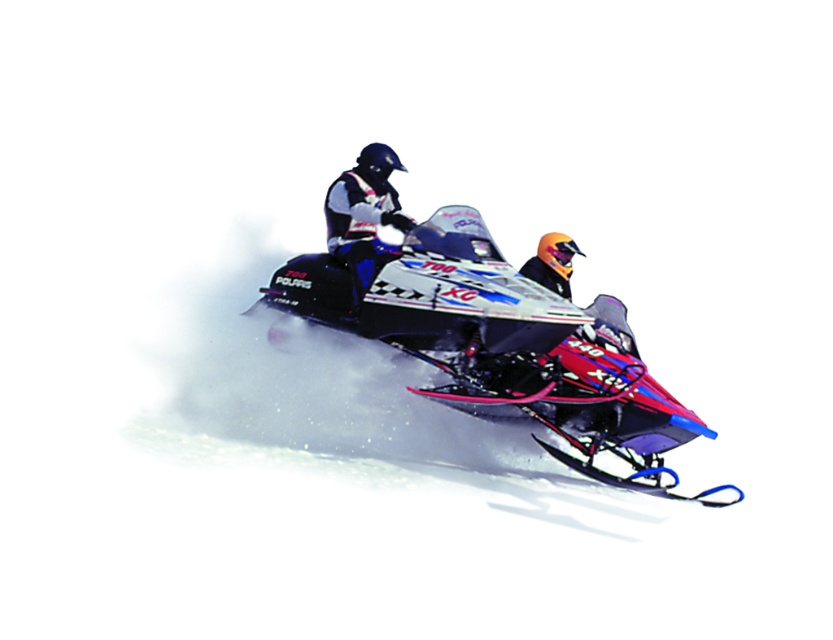
Which is below, shiny metallic snowmobile at center or orange matte helmet at center?

Positioned lower is shiny metallic snowmobile at center.

Does shiny metallic snowmobile at center appear on the left side of orange matte helmet at center?

Indeed, shiny metallic snowmobile at center is positioned on the left side of orange matte helmet at center.

Describe the element at coordinates (504, 348) in the screenshot. This screenshot has height=640, width=833. I see `shiny metallic snowmobile at center` at that location.

Identify the location of shiny metallic snowmobile at center. The image size is (833, 640). (504, 348).

Does shiny metallic snowmobile at center have a greater width compared to matte black helmet at center?

Yes.

Is shiny metallic snowmobile at center bigger than matte black helmet at center?

Correct, shiny metallic snowmobile at center is larger in size than matte black helmet at center.

This screenshot has width=833, height=640. I want to click on shiny metallic snowmobile at center, so click(x=504, y=348).

Is matte black helmet at center shorter than orange matte helmet at center?

Incorrect, matte black helmet at center's height does not fall short of orange matte helmet at center's.

Is point (328, 188) positioned behind point (537, 269)?

Yes, point (328, 188) is farther from viewer.

Which is behind, point (372, 172) or point (540, 260)?

Point (372, 172)

Where is `matte black helmet at center`? matte black helmet at center is located at coordinates click(x=363, y=212).